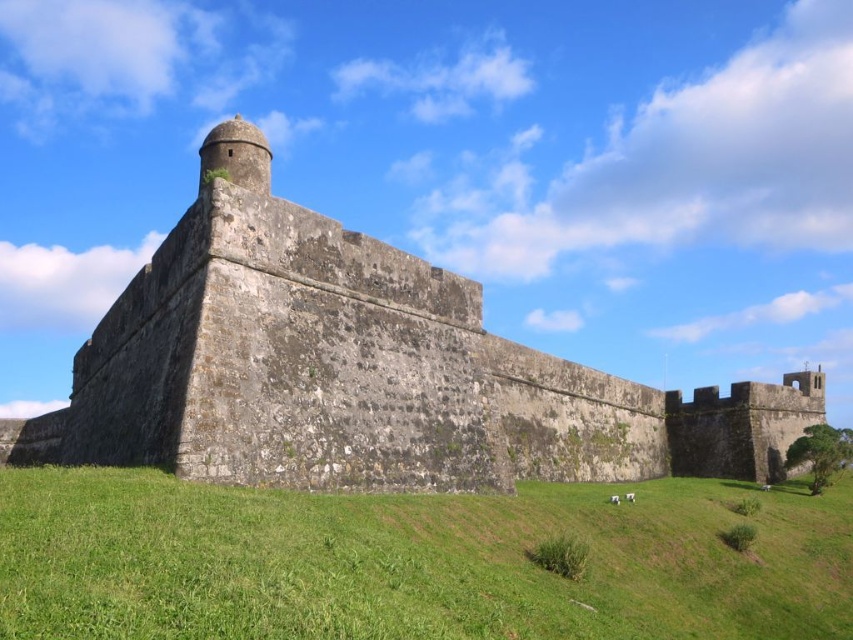
Who is taller, stone wall at center or green grass at lower center?

With more height is stone wall at center.

Can you confirm if stone wall at center is smaller than green grass at lower center?

No, stone wall at center is not smaller than green grass at lower center.

Locate an element on the screen. The image size is (853, 640). stone wall at center is located at coordinates (363, 369).